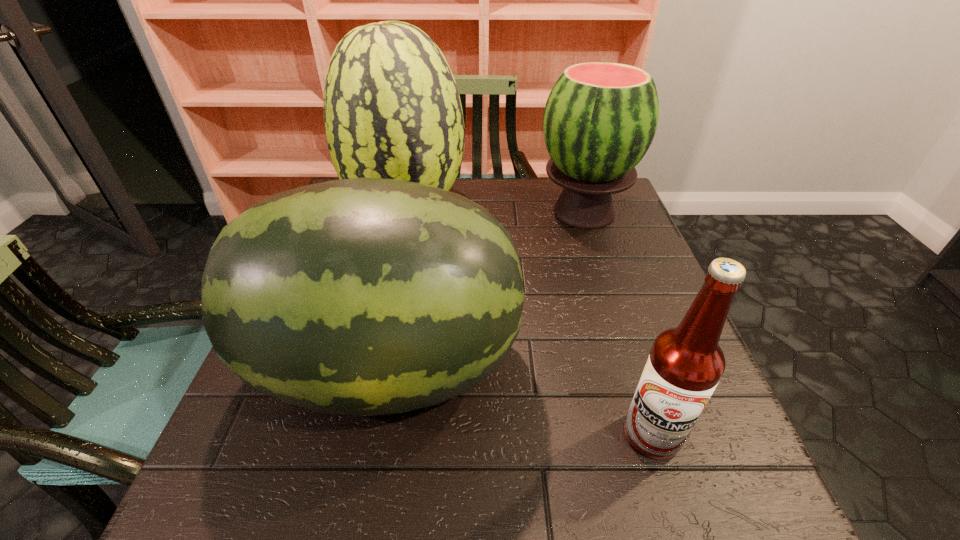
Where is `the tallest object`? This screenshot has height=540, width=960. the tallest object is located at coordinates (392, 110).

At what (x,y) coordinates should I click in order to perform the action: click on the rightmost watermelon. Please return your answer as a coordinate pair (x, y). Looking at the image, I should click on (600, 118).

Image resolution: width=960 pixels, height=540 pixels. I want to click on the nearest watermelon, so click(x=368, y=296).

This screenshot has height=540, width=960. Find the location of `alcohol`. alcohol is located at coordinates (685, 364).

The width and height of the screenshot is (960, 540). Find the location of `free space located 0.250m on the right of the tallest watermelon`. free space located 0.250m on the right of the tallest watermelon is located at coordinates (558, 209).

Identify the location of vacant region located on the front of the rightmost watermelon. This screenshot has height=540, width=960. (615, 312).

Locate an element on the screen. Image resolution: width=960 pixels, height=540 pixels. vacant space situated on the back of the nearest watermelon is located at coordinates coord(404,282).

Locate an element on the screen. The image size is (960, 540). vacant space situated 0.070m on the label side of the alcohol is located at coordinates (676, 510).

The image size is (960, 540). Identify the location of watermelon present at the right edge. (600, 118).

At what (x,y) coordinates should I click in order to perform the action: click on alcohol present at the right edge. Please return your answer as a coordinate pair (x, y). Looking at the image, I should click on (685, 364).